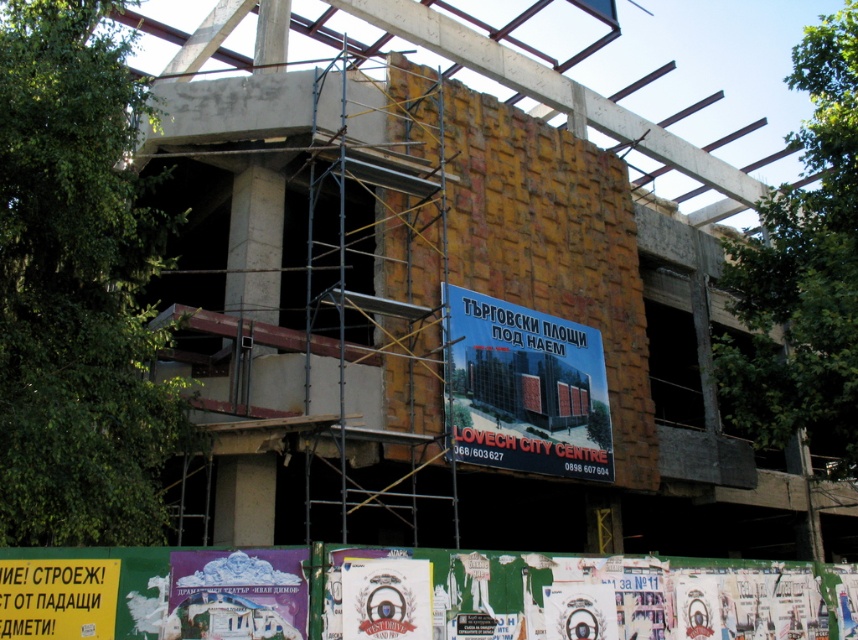
Question: Is yellowish wood scaffolding at center to the left of purple paper at center from the viewer's perspective?

Choices:
 (A) no
 (B) yes

Answer: (A)

Question: Does yellowish wood scaffolding at center come behind matte blue signboard at center?

Choices:
 (A) yes
 (B) no

Answer: (B)

Question: Which is farther from the yellowish wood scaffolding at center?

Choices:
 (A) matte blue signboard at center
 (B) purple paper at center

Answer: (B)

Question: Does matte blue signboard at center appear over purple paper at center?

Choices:
 (A) no
 (B) yes

Answer: (B)

Question: Which of the following is the farthest from the observer?

Choices:
 (A) matte blue signboard at center
 (B) purple paper at center

Answer: (A)

Question: Which object is farther from the camera taking this photo?

Choices:
 (A) matte blue signboard at center
 (B) purple paper at center
 (C) yellowish wood scaffolding at center

Answer: (A)